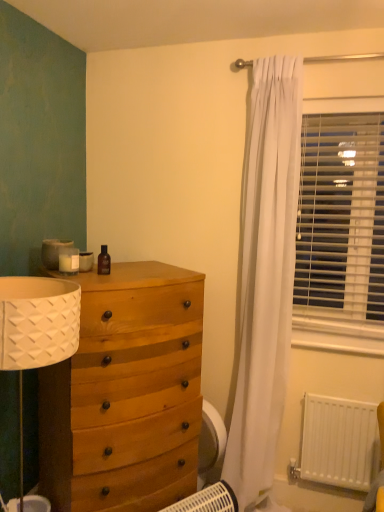
Where is `free location above white matte radiator at lower right (from a real-world perspective)`? free location above white matte radiator at lower right (from a real-world perspective) is located at coordinates (349, 394).